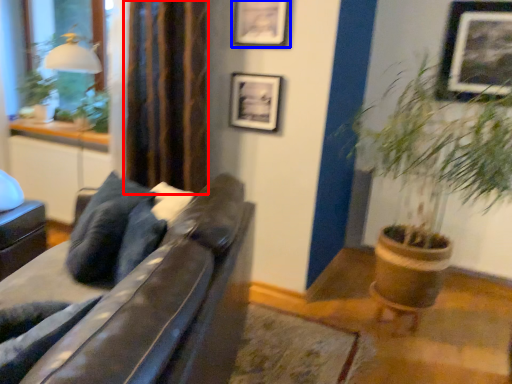
Question: Among these objects, which one is farthest to the camera, curtain (highlighted by a red box) or picture frame (highlighted by a blue box)?

Choices:
 (A) curtain
 (B) picture frame

Answer: (B)